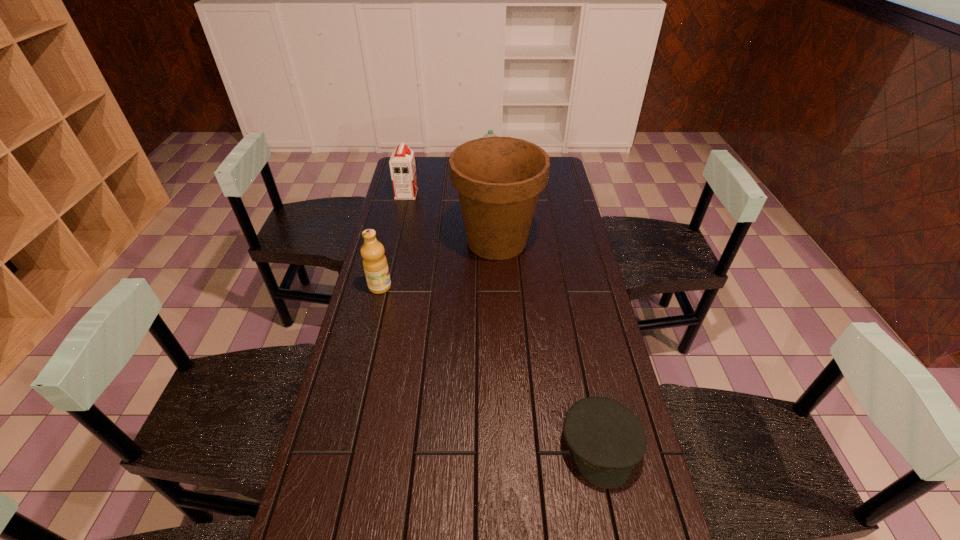
Where is `free space located on the label of the olive oil`? Image resolution: width=960 pixels, height=540 pixels. free space located on the label of the olive oil is located at coordinates (453, 287).

Where is `free location located on the front-facing side of the beret`? The height and width of the screenshot is (540, 960). free location located on the front-facing side of the beret is located at coordinates (613, 512).

The height and width of the screenshot is (540, 960). I want to click on object located at the far edge, so click(490, 133).

Where is `soya milk that is at the left edge`? soya milk that is at the left edge is located at coordinates (402, 162).

The image size is (960, 540). I want to click on olive oil that is at the left edge, so click(x=375, y=265).

You are a GUI agent. You are given a task and a screenshot of the screen. Output one action in this format:
    pyautogui.click(x=<x>, y=<y>)
    Task: Click on the flowerpot that is at the right edge
    This screenshot has height=540, width=960.
    Given the screenshot: What is the action you would take?
    pyautogui.click(x=498, y=179)

The width and height of the screenshot is (960, 540). I want to click on beret positioned at the right edge, so click(x=606, y=438).

Where is `vacant space at the left edge`? The height and width of the screenshot is (540, 960). vacant space at the left edge is located at coordinates (396, 244).

The image size is (960, 540). In order to click on vacant position at the right edge of the desktop in this screenshot , I will do `click(565, 195)`.

In the image, there is a desktop. At what (x,y) coordinates should I click in order to perform the action: click on vacant space at the far left corner. Please return your answer as a coordinate pair (x, y). Looking at the image, I should click on (430, 175).